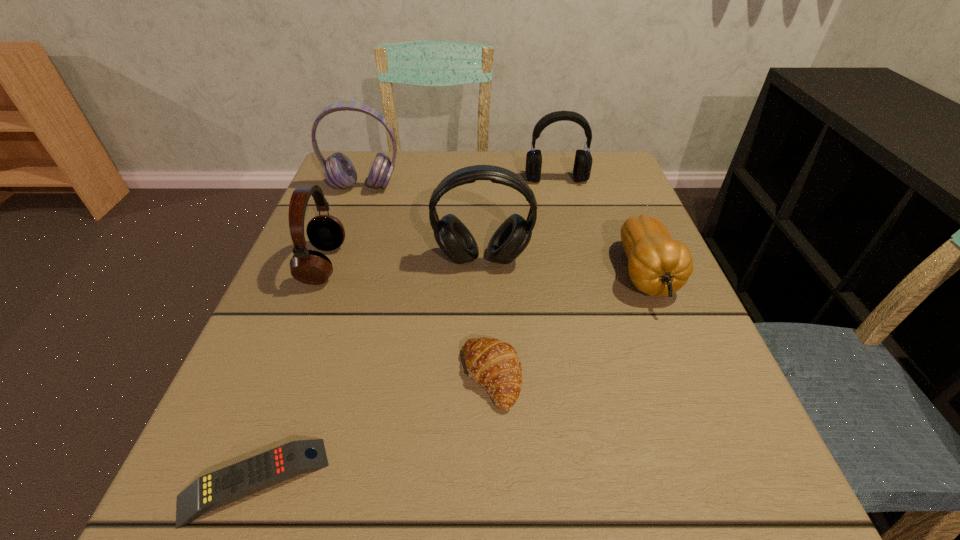
Where is `headset that can be found as the second closest to the second headset from right to left`? The height and width of the screenshot is (540, 960). headset that can be found as the second closest to the second headset from right to left is located at coordinates (339, 171).

What are the coordinates of `the second closest headset to the second headset from right to left` in the screenshot? It's located at (339, 171).

This screenshot has width=960, height=540. In order to click on vacant area in the image that satisfies the following two spatial constraints: 1. on the earcups of the third headset from left to right; 2. on the left side of the second shortest object in this screenshot , I will do `click(484, 377)`.

Image resolution: width=960 pixels, height=540 pixels. I want to click on vacant region that satisfies the following two spatial constraints: 1. on the earcups of the third headset from left to right; 2. on the left side of the second nearest object, so click(x=484, y=377).